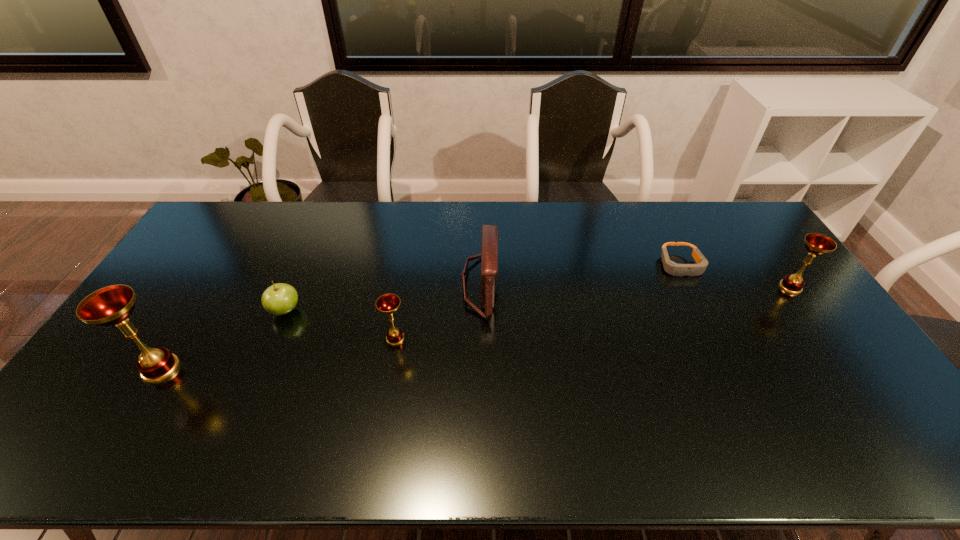
At what (x,y) coordinates should I click in order to perform the action: click on chalice that is the second closest to the third object from right to left. Please return your answer as a coordinate pair (x, y). Looking at the image, I should click on (112, 305).

This screenshot has height=540, width=960. In order to click on vacant space that satisfies the following two spatial constraints: 1. on the front and back of the farthest chalice; 2. on the right side of the shortest object in this screenshot , I will do `click(691, 287)`.

Where is `free spot that satisfies the following two spatial constraints: 1. on the front and back of the rightmost object; 2. on the left side of the goggles`? Image resolution: width=960 pixels, height=540 pixels. free spot that satisfies the following two spatial constraints: 1. on the front and back of the rightmost object; 2. on the left side of the goggles is located at coordinates (691, 287).

Where is `vacant space that satisfies the following two spatial constraints: 1. on the front flap of the third object from right to left; 2. on the left side of the rightmost chalice`? The width and height of the screenshot is (960, 540). vacant space that satisfies the following two spatial constraints: 1. on the front flap of the third object from right to left; 2. on the left side of the rightmost chalice is located at coordinates (480, 287).

I want to click on blank area in the image that satisfies the following two spatial constraints: 1. on the front flap of the shoulder bag; 2. on the front side of the fifth object from right to left, so click(480, 310).